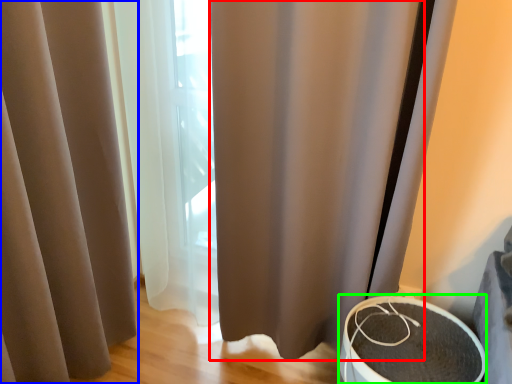
Question: Which object is positioned farthest from shower curtain (highlighted by a red box)? Select from curtain (highlighted by a blue box) and round table (highlighted by a green box).

Choices:
 (A) curtain
 (B) round table

Answer: (A)